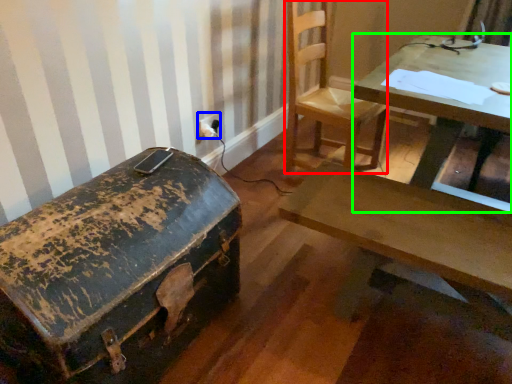
Question: Which is farther away from chair (highlighted by a red box)? electric outlet (highlighted by a blue box) or table (highlighted by a green box)?

Choices:
 (A) electric outlet
 (B) table

Answer: (A)